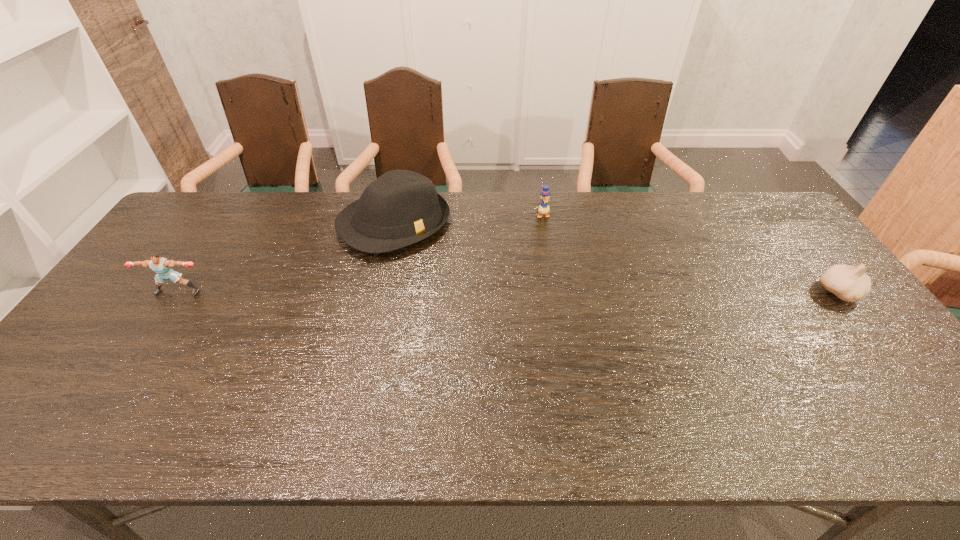
Find the location of a particular element. Image resolution: width=960 pixels, height=540 pixels. free spot between the second object from right to left and the garlic is located at coordinates (690, 254).

Select which object appears as the third closest to the leftmost object. Please provide its 2D coordinates. Your answer should be formatted as a tuple, i.e. [(x, y)], where the tuple contains the x and y coordinates of a point satisfying the conditions above.

[(849, 283)]

Identify which object is located as the nearest to the second object from right to left. Please provide its 2D coordinates. Your answer should be formatted as a tuple, i.e. [(x, y)], where the tuple contains the x and y coordinates of a point satisfying the conditions above.

[(401, 207)]

Image resolution: width=960 pixels, height=540 pixels. Identify the location of vacant region that satisfies the following two spatial constraints: 1. on the front-facing side of the leftmost object; 2. on the left side of the rightmost object. (177, 293).

Find the location of a particular element. vacant area in the image that satisfies the following two spatial constraints: 1. on the front-facing side of the puncher; 2. on the left side of the garlic is located at coordinates [x=177, y=293].

What are the coordinates of `blank space that satisfies the following two spatial constraints: 1. on the front-facing side of the puncher; 2. on the right side of the garlic` in the screenshot? It's located at coord(177,293).

Locate an element on the screen. The height and width of the screenshot is (540, 960). free spot that satisfies the following two spatial constraints: 1. on the front side of the rightmost object; 2. on the right side of the fedora is located at coordinates (379, 293).